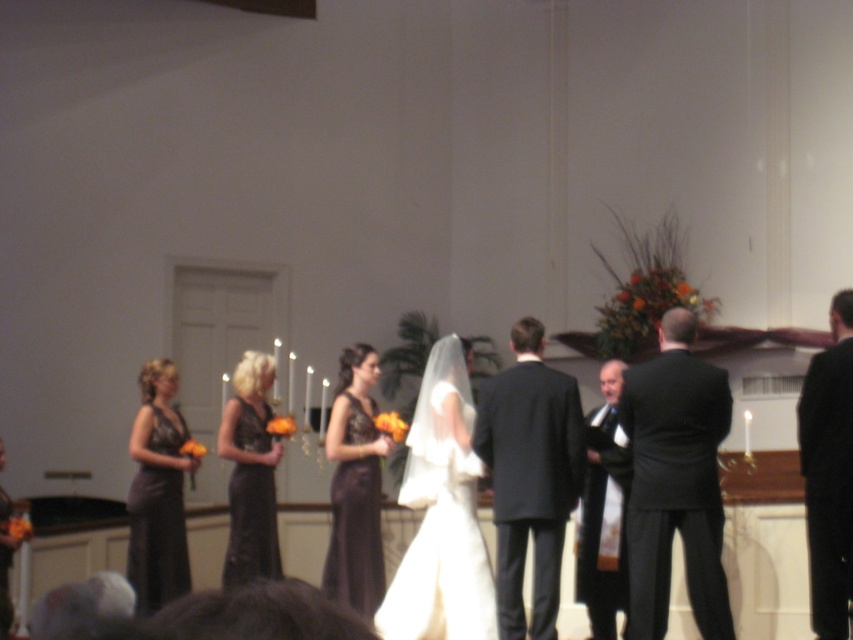
You are a photographer at this wedding. You need to position the black satin suit at right and the black satin dress at center so that they fit within a 1.5 meter wide frame. Given their widths, which one might require adjusting its position to ensure it fits?

The black satin suit at right has a larger width than the black satin dress at center, so the black satin suit at right might require adjusting its position to ensure it fits within the 1.5 meter wide frame.

You are a photographer at a wedding and need to position yourself to capture both the black satin suit at right and the black suit at right in the same frame. Based on their positions, which one should you focus on first to ensure both are in the shot?

The black satin suit at right is to the left of the black suit at right, so you should focus on the black satin suit at right first to ensure both are in the frame.